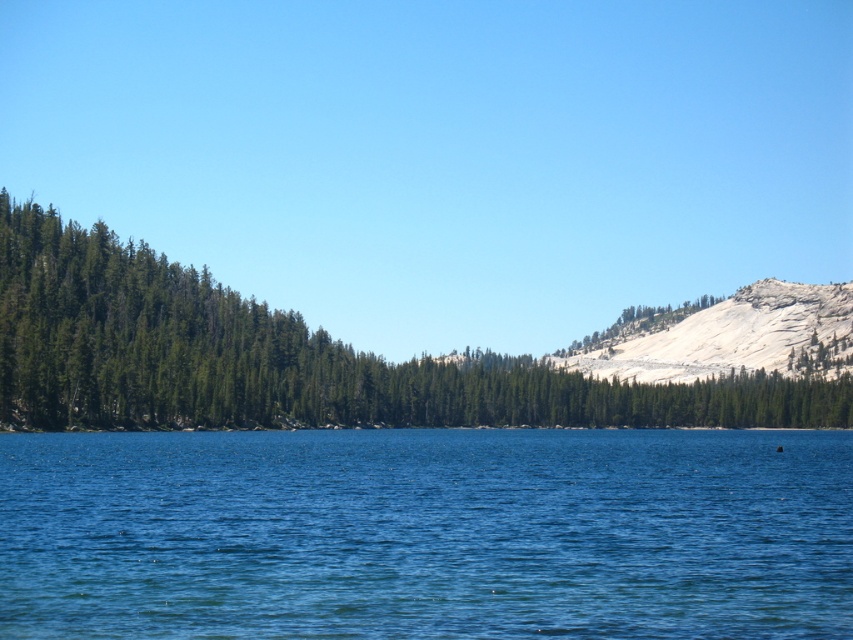
Question: Is green matte trees at left to the right of gray/granite mountain at right from the viewer's perspective?

Choices:
 (A) yes
 (B) no

Answer: (B)

Question: Which is farther from the gray/granite mountain at right?

Choices:
 (A) blue liquid water at center
 (B) green matte trees at left

Answer: (A)

Question: Which point is closer to the camera?

Choices:
 (A) (740, 312)
 (B) (169, 426)

Answer: (B)

Question: Is green matte trees at left wider than gray/granite mountain at right?

Choices:
 (A) no
 (B) yes

Answer: (B)

Question: Which point is farther from the camera taking this photo?

Choices:
 (A) pyautogui.click(x=439, y=532)
 (B) pyautogui.click(x=834, y=352)
 (C) pyautogui.click(x=515, y=369)

Answer: (B)

Question: Is green matte trees at left closer to the viewer compared to gray/granite mountain at right?

Choices:
 (A) yes
 (B) no

Answer: (A)